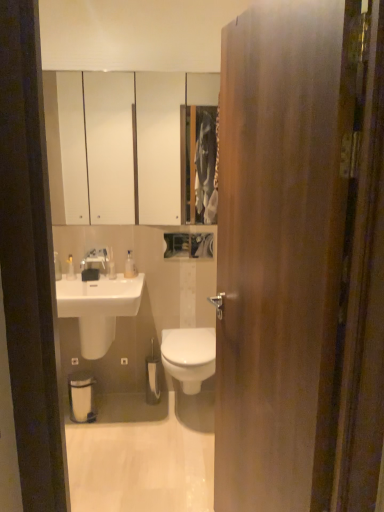
The image size is (384, 512). Describe the element at coordinates (146, 460) in the screenshot. I see `white glossy floor at center` at that location.

What do you see at coordinates (70, 268) in the screenshot? I see `translucent plastic bottles at left, the 2th toiletry from the right` at bounding box center [70, 268].

Identify the location of clear plastic bottle at upper center, which is the 2th toiletry in left-to-right order. (130, 266).

What is the approximate width of wooden door at center?

wooden door at center is 5.70 inches wide.

Measure the distance between point (x=88, y=263) and camera.

Point (x=88, y=263) and camera are 8.73 feet apart.

Locate an element on the screen. The image size is (384, 512). white glossy bidet at center is located at coordinates (189, 356).

Is translucent plastic bottles at left, the 2th toiletry from the right, oriented towards wooden door at center?

No, translucent plastic bottles at left, the 2th toiletry from the right, is not facing towards wooden door at center.

Which point is more distant from viewer, (71, 267) or (273, 342)?

The point (71, 267) is behind.

Considering the sizes of objects translucent plastic bottles at left, the 2th toiletry from the right, and wooden door at center in the image provided, who is taller, translucent plastic bottles at left, the 2th toiletry from the right, or wooden door at center?

With more height is wooden door at center.

Which of these two, satin nickel faucet at upper center or white glossy sink at lower left, is smaller?

Smaller between the two is satin nickel faucet at upper center.

Find the location of a particular element. The height and width of the screenshot is (512, 384). tap behind the white glossy sink at lower left is located at coordinates (96, 260).

Can you tell me how much satin nickel faucet at upper center and white glossy sink at lower left differ in facing direction?

satin nickel faucet at upper center and white glossy sink at lower left are facing 2.61 degrees away from each other.

Looking at this image, considering the positions of objects white matte toilet paper at center and white glossy medicine cabinet at upper center in the image provided, who is more to the left, white matte toilet paper at center or white glossy medicine cabinet at upper center?

white glossy medicine cabinet at upper center.

Is white matte toilet paper at center completely or partially outside of white glossy medicine cabinet at upper center?

white matte toilet paper at center is positioned outside white glossy medicine cabinet at upper center.

Are white matte toilet paper at center and white glossy medicine cabinet at upper center far apart?

Absolutely, white matte toilet paper at center is distant from white glossy medicine cabinet at upper center.

From a real-world perspective, is white glossy medicine cabinet at upper center physically located above or below translucent plastic bottles at left, the 2th toiletry from the right?

From a real-world perspective, white glossy medicine cabinet at upper center is physically above translucent plastic bottles at left, the 2th toiletry from the right.

Is white glossy medicine cabinet at upper center directly adjacent to translucent plastic bottles at left, the 1th toiletry in the left-to-right sequence?

No, white glossy medicine cabinet at upper center is not in contact with translucent plastic bottles at left, the 1th toiletry in the left-to-right sequence.

Considering the points (204, 108) and (67, 278), which point is in front, point (204, 108) or point (67, 278)?

Point (67, 278)

Is white glossy medicine cabinet at upper center situated inside translucent plastic bottles at left, the 2th toiletry from the right, or outside?

white glossy medicine cabinet at upper center is located beyond the bounds of translucent plastic bottles at left, the 2th toiletry from the right.

Is clear plastic bottle at upper center, marked as the 1th toiletry in a right-to-left arrangement, positioned far away from white glossy bidet at center?

clear plastic bottle at upper center, marked as the 1th toiletry in a right-to-left arrangement, is actually quite close to white glossy bidet at center.

Can you confirm if clear plastic bottle at upper center, marked as the 1th toiletry in a right-to-left arrangement, is shorter than white glossy bidet at center?

Correct, clear plastic bottle at upper center, marked as the 1th toiletry in a right-to-left arrangement, is not as tall as white glossy bidet at center.

What's the angular difference between clear plastic bottle at upper center, marked as the 1th toiletry in a right-to-left arrangement, and white glossy bidet at center's facing directions?

The angle between the facing direction of clear plastic bottle at upper center, marked as the 1th toiletry in a right-to-left arrangement, and the facing direction of white glossy bidet at center is 0.292 degrees.

Locate an element on the screen. The image size is (384, 512). bidet in front of the clear plastic bottle at upper center, marked as the 1th toiletry in a right-to-left arrangement is located at coordinates (189, 356).

From the picture: Which object is closer to the camera, satin nickel faucet at upper center or white glossy bidet at center?

white glossy bidet at center is in front.

Between point (108, 249) and point (184, 343), which one is positioned behind?

The point (108, 249) is more distant.

Considering the positions of points (181, 80) and (214, 329), is point (181, 80) closer to camera compared to point (214, 329)?

That is False.

Can you confirm if white glossy medicine cabinet at upper center is positioned to the right of white glossy bidet at center?

In fact, white glossy medicine cabinet at upper center is to the left of white glossy bidet at center.

How many degrees apart are the facing directions of white glossy medicine cabinet at upper center and white glossy bidet at center?

They differ by 0.41 degrees in their facing directions.

Is white glossy medicine cabinet at upper center taller or shorter than white glossy bidet at center?

In the image, white glossy medicine cabinet at upper center appears to be taller than white glossy bidet at center.

Find the location of a particular element. toiletry that is the 2nd one when counting leftward from the wooden door at center is located at coordinates (70, 268).

What are the coordinates of `tap behind the white glossy sink at lower left` in the screenshot? It's located at (96, 260).

Considering their positions, is white glossy bidet at center positioned further to translucent plastic bottles at left, the 2th toiletry from the right, than white glossy medicine cabinet at upper center?

white glossy medicine cabinet at upper center is further to translucent plastic bottles at left, the 2th toiletry from the right.

Which object lies nearer to the anchor point white glossy sink at lower left, clear plastic bottle at upper center, which is the 2th toiletry in left-to-right order, or satin nickel faucet at upper center?

satin nickel faucet at upper center.

From the image, which object appears to be farther from wooden door at center, white glossy sink at lower left or clear plastic bottle at upper center, marked as the 1th toiletry in a right-to-left arrangement?

clear plastic bottle at upper center, marked as the 1th toiletry in a right-to-left arrangement, lies further to wooden door at center than the other object.

Estimate the real-world distances between objects in this image. Which object is further from translucent plastic bottles at left, the 2th toiletry from the right, satin nickel faucet at upper center or clear plastic bottle at upper center, marked as the 1th toiletry in a right-to-left arrangement?

Among the two, clear plastic bottle at upper center, marked as the 1th toiletry in a right-to-left arrangement, is located further to translucent plastic bottles at left, the 2th toiletry from the right.

Looking at the image, which one is located closer to white glossy medicine cabinet at upper center, white glossy floor at center or white glossy sink at lower left?

white glossy sink at lower left is closer to white glossy medicine cabinet at upper center.

Based on their spatial positions, is white glossy medicine cabinet at upper center or clear plastic bottle at upper center, which is the 2th toiletry in left-to-right order, closer to white glossy sink at lower left?

clear plastic bottle at upper center, which is the 2th toiletry in left-to-right order.

From the image, which object appears to be farther from wooden door at center, translucent plastic bottles at left, the 1th toiletry in the left-to-right sequence, or white glossy medicine cabinet at upper center?

The object further to wooden door at center is white glossy medicine cabinet at upper center.

From the image, which object appears to be nearer to white glossy sink at lower left, translucent plastic bottles at left, the 2th toiletry from the right, or satin nickel faucet at upper center?

satin nickel faucet at upper center is positioned closer to the anchor white glossy sink at lower left.

Locate an element on the screen. The width and height of the screenshot is (384, 512). sink between clear plastic bottle at upper center, which is the 2th toiletry in left-to-right order, and white glossy bidet at center from top to bottom is located at coordinates (98, 308).

I want to click on sink positioned between wooden door at center and translucent plastic bottles at left, the 1th toiletry in the left-to-right sequence, from near to far, so click(x=98, y=308).

Identify the location of bidet between translucent plastic bottles at left, the 2th toiletry from the right, and white matte toilet paper at center in the up-down direction. This screenshot has width=384, height=512. (189, 356).

Where is `medicine cabinet positioned between wooden door at center and clear plastic bottle at upper center, which is the 2th toiletry in left-to-right order, from near to far`? This screenshot has width=384, height=512. medicine cabinet positioned between wooden door at center and clear plastic bottle at upper center, which is the 2th toiletry in left-to-right order, from near to far is located at coordinates (130, 147).